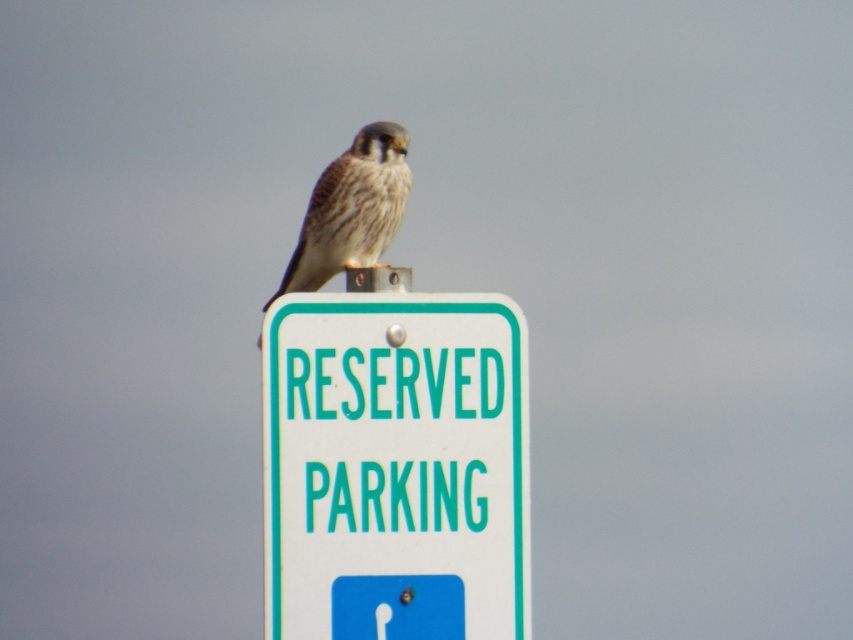
You are a delivery driver who needs to park your van near the reserved parking area. You see a white plastic sign at center and a speckled feathered falcon at center. Which object is wider?

The white plastic sign at center is wider than the speckled feathered falcon at center.

You are standing at the center of the image. Which direction should you move to reach the white plastic sign at center?

Since the white plastic sign at center is already at the center of the image, you don t need to move in any direction to reach it.